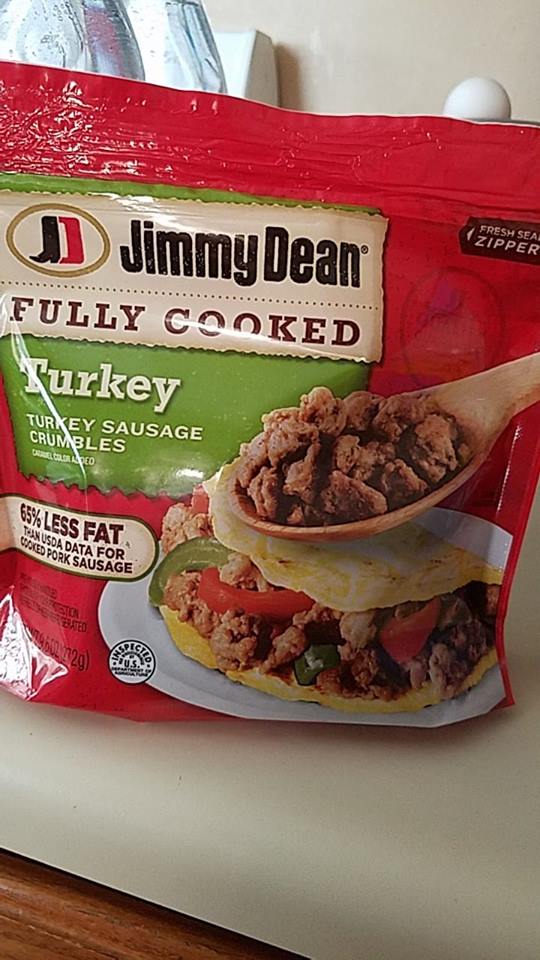
Image resolution: width=540 pixels, height=960 pixels. In order to click on plate in this screenshot , I will do `click(188, 665)`, `click(141, 592)`, `click(256, 708)`.